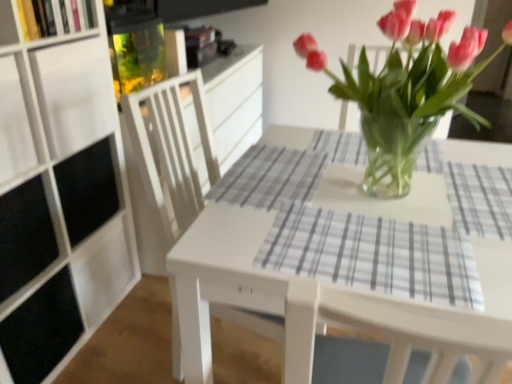
Find the location of a particular element. free spot to the left of gray plaid placemat at center is located at coordinates (240, 240).